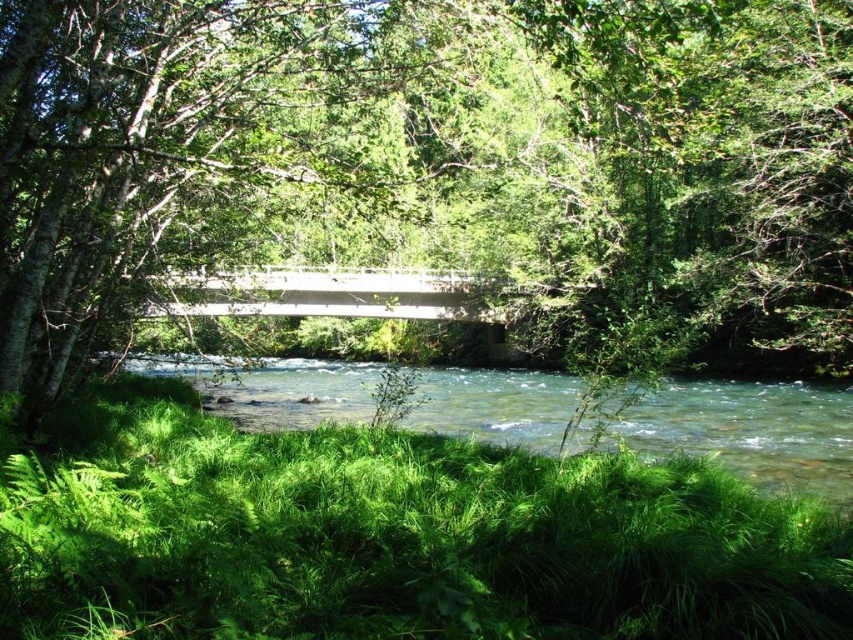
Question: In this image, where is green leafy grass at lower center located relative to clear water at center?

Choices:
 (A) left
 (B) right

Answer: (A)

Question: Can you confirm if green leafy tree at center is positioned above clear water at center?

Choices:
 (A) yes
 (B) no

Answer: (A)

Question: Is green leafy tree at center positioned at the back of green leafy grass at lower center?

Choices:
 (A) yes
 (B) no

Answer: (A)

Question: Which is farther from the clear water at center?

Choices:
 (A) green leafy tree at center
 (B) green leafy grass at lower center

Answer: (B)

Question: Which is nearer to the green leafy tree at center?

Choices:
 (A) clear water at center
 (B) green leafy grass at lower center

Answer: (A)

Question: Which point appears farthest from the camera in this image?

Choices:
 (A) (506, 412)
 (B) (595, 316)

Answer: (B)